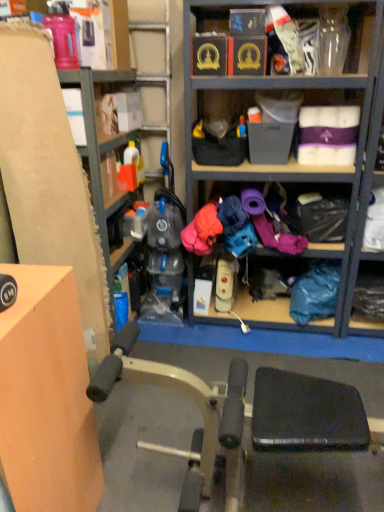
Question: Does matte cardboard box at left lie in front of blue fabric bag at lower right?

Choices:
 (A) no
 (B) yes

Answer: (B)

Question: Does matte cardboard box at left have a lesser height compared to blue fabric bag at lower right?

Choices:
 (A) no
 (B) yes

Answer: (A)

Question: Is matte cardboard box at left bigger than blue fabric bag at lower right?

Choices:
 (A) no
 (B) yes

Answer: (B)

Question: Does matte cardboard box at left have a greater height compared to blue fabric bag at lower right?

Choices:
 (A) no
 (B) yes

Answer: (B)

Question: From the image's perspective, is matte cardboard box at left under blue fabric bag at lower right?

Choices:
 (A) yes
 (B) no

Answer: (B)

Question: Does matte cardboard box at left lie behind blue fabric bag at lower right?

Choices:
 (A) no
 (B) yes

Answer: (A)

Question: Could you tell me if blue fabric bag at lower right is facing orange matte table at left?

Choices:
 (A) no
 (B) yes

Answer: (A)

Question: Considering the relative sizes of blue fabric bag at lower right and orange matte table at left in the image provided, is blue fabric bag at lower right thinner than orange matte table at left?

Choices:
 (A) yes
 (B) no

Answer: (A)

Question: From the image's perspective, is blue fabric bag at lower right located beneath orange matte table at left?

Choices:
 (A) no
 (B) yes

Answer: (A)

Question: Considering the relative sizes of blue fabric bag at lower right and orange matte table at left in the image provided, is blue fabric bag at lower right bigger than orange matte table at left?

Choices:
 (A) no
 (B) yes

Answer: (A)

Question: Is blue fabric bag at lower right in front of orange matte table at left?

Choices:
 (A) yes
 (B) no

Answer: (B)

Question: Is blue fabric bag at lower right positioned beyond the bounds of orange matte table at left?

Choices:
 (A) no
 (B) yes

Answer: (B)

Question: From the image's perspective, is blue fabric bag at lower right located above matte cardboard box at left?

Choices:
 (A) yes
 (B) no

Answer: (B)